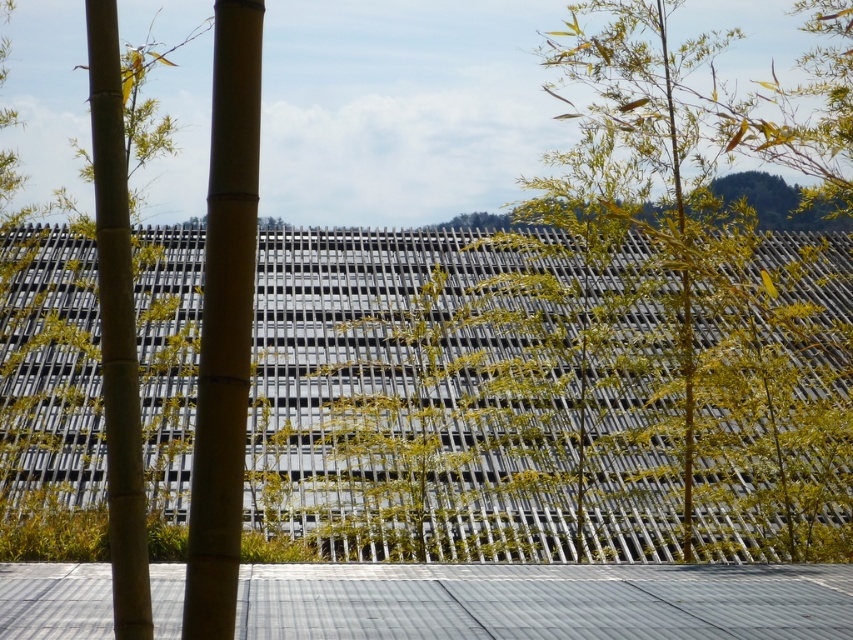
You are standing in the middle of the scene and want to walk towards the green bamboo forest at center and the smooth bamboo pole at center. Which one is closer to you?

The green bamboo forest at center is closer to you because it has a larger size compared to the smooth bamboo pole at center, indicating it is nearer.

You are an architect designing a garden path that needs to fit between the smooth bamboo pole at center and the green bamboo at left. The path must be at least 1.2 meters wide. Can the space between them accommodate this width?

The smooth bamboo pole at center is narrower than the green bamboo at left. However, the description only provides information about their widths, not the distance between them. Without knowing the actual spacing between the two bamboos, it is impossible to determine if the 1.2 meter path requirement can be met.